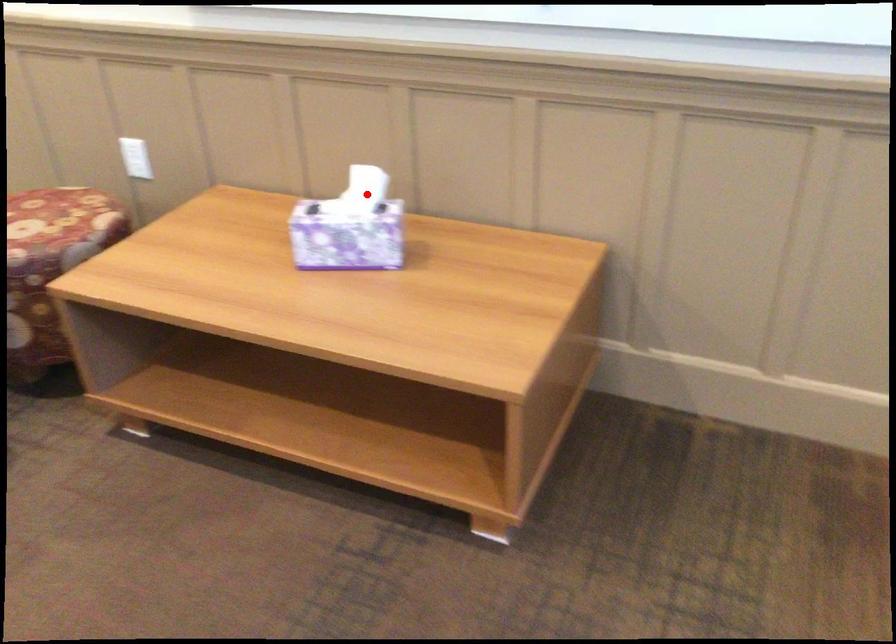
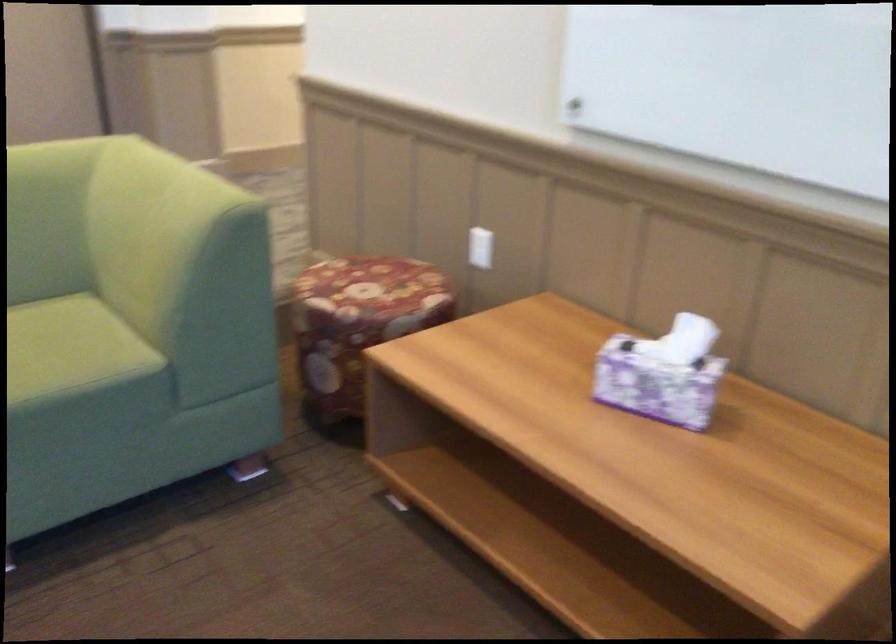
Find the pixel in the second image that matches the highlighted location in the first image.

(690, 341)